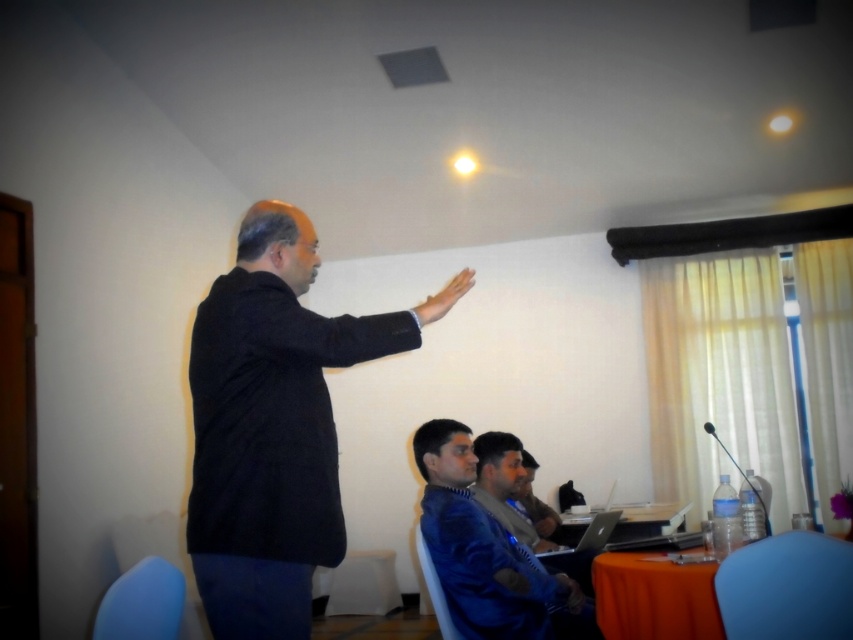
Question: Can you confirm if orange fabric table at lower right is bigger than blue velvet jacket at lower center?

Choices:
 (A) no
 (B) yes

Answer: (A)

Question: Which object is closer to the camera taking this photo?

Choices:
 (A) black matte suit at upper left
 (B) orange fabric table at lower right
 (C) blue velvet jacket at lower center

Answer: (A)

Question: In this image, where is black matte suit at upper left located relative to blue velvet jacket at lower center?

Choices:
 (A) right
 (B) left

Answer: (B)

Question: Which object is farther from the camera taking this photo?

Choices:
 (A) black matte suit at upper left
 (B) orange fabric table at lower right

Answer: (B)

Question: Does black matte suit at upper left have a greater width compared to orange fabric table at lower right?

Choices:
 (A) yes
 (B) no

Answer: (A)

Question: Which object is farther from the camera taking this photo?

Choices:
 (A) orange fabric table at lower right
 (B) blue velvet jacket at lower center

Answer: (A)